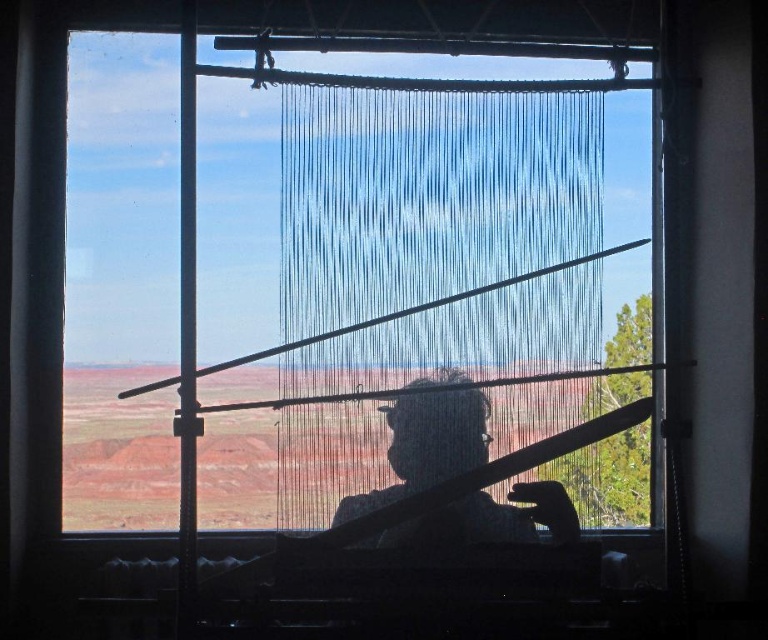
Question: Is blue string curtain at center positioned at the back of transparent glass window at center?

Choices:
 (A) yes
 (B) no

Answer: (B)

Question: Is blue string curtain at center smaller than transparent glass window at center?

Choices:
 (A) yes
 (B) no

Answer: (A)

Question: Based on their relative distances, which object is nearer to the blue string curtain at center?

Choices:
 (A) silhouette fabric at center
 (B) transparent glass window at center

Answer: (A)

Question: Which point appears closest to the camera in this image?

Choices:
 (A) (631, 186)
 (B) (449, 410)
 (C) (329, 410)

Answer: (B)

Question: Which object appears closest to the camera in this image?

Choices:
 (A) transparent glass window at center
 (B) blue string curtain at center
 (C) silhouette fabric at center

Answer: (C)

Question: Observing the image, what is the correct spatial positioning of blue string curtain at center in reference to silhouette fabric at center?

Choices:
 (A) below
 (B) above

Answer: (B)